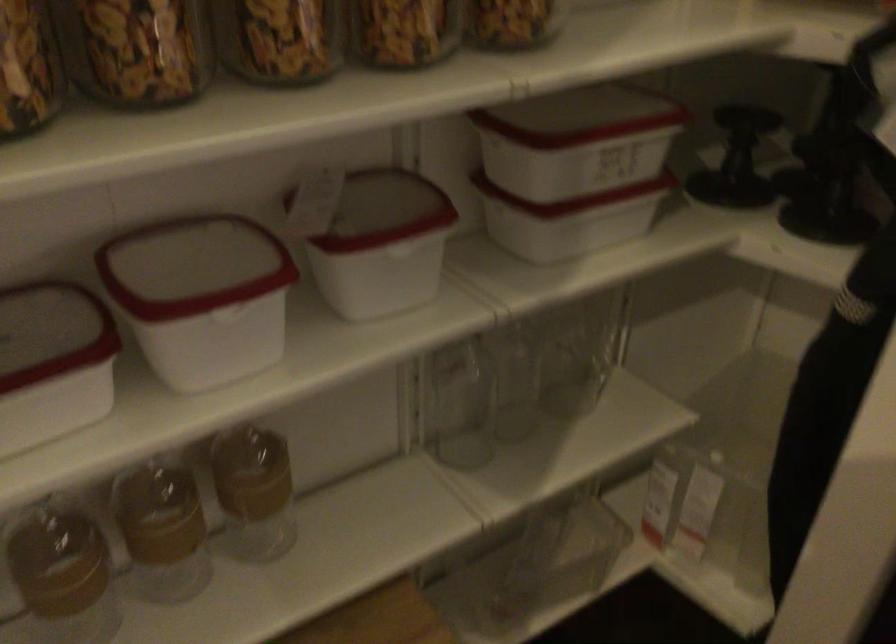
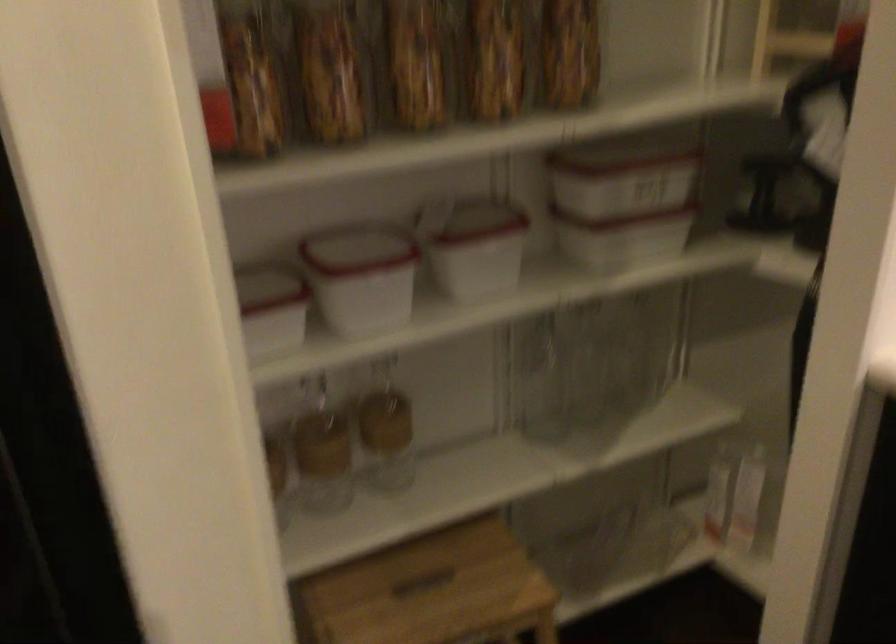
Question: In a continuous first-person perspective shot, in which direction is the camera moving?

Choices:
 (A) Left
 (B) Right
 (C) Forward
 (D) Backward

Answer: (D)